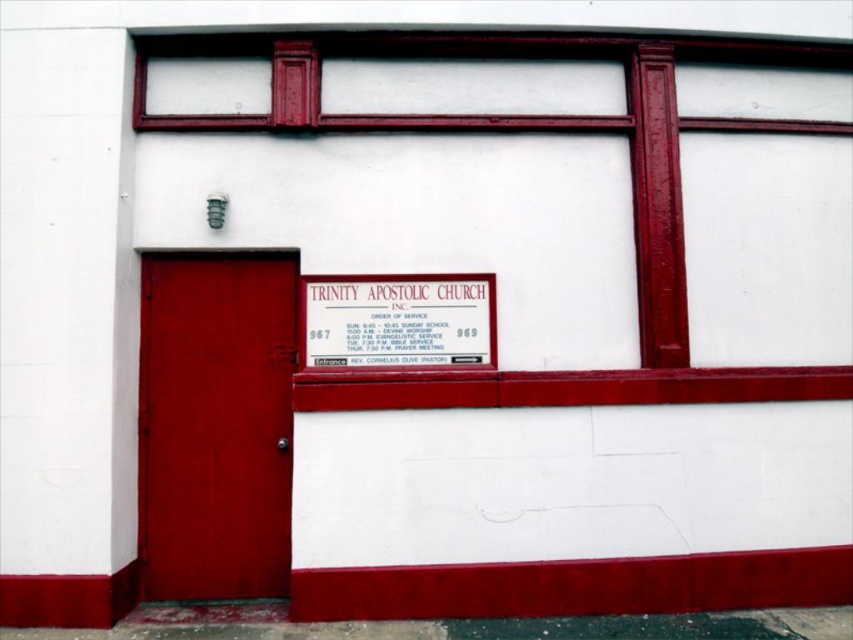
Question: Considering the relative positions of white matte sign at upper center and metallic gold sign at center in the image provided, where is white matte sign at upper center located with respect to metallic gold sign at center?

Choices:
 (A) left
 (B) right

Answer: (B)

Question: Which object is the closest to the metallic gold sign at center?

Choices:
 (A) matte red door at left
 (B) white matte sign at upper center

Answer: (A)

Question: Which of these objects is positioned closest to the white matte sign at upper center?

Choices:
 (A) metallic gold sign at center
 (B) matte red door at left

Answer: (A)

Question: Can you confirm if matte red door at left is wider than white matte sign at upper center?

Choices:
 (A) yes
 (B) no

Answer: (B)

Question: Which object is the closest to the metallic gold sign at center?

Choices:
 (A) white matte sign at upper center
 (B) matte red door at left

Answer: (B)

Question: Can you confirm if matte red door at left is positioned above metallic gold sign at center?

Choices:
 (A) yes
 (B) no

Answer: (B)